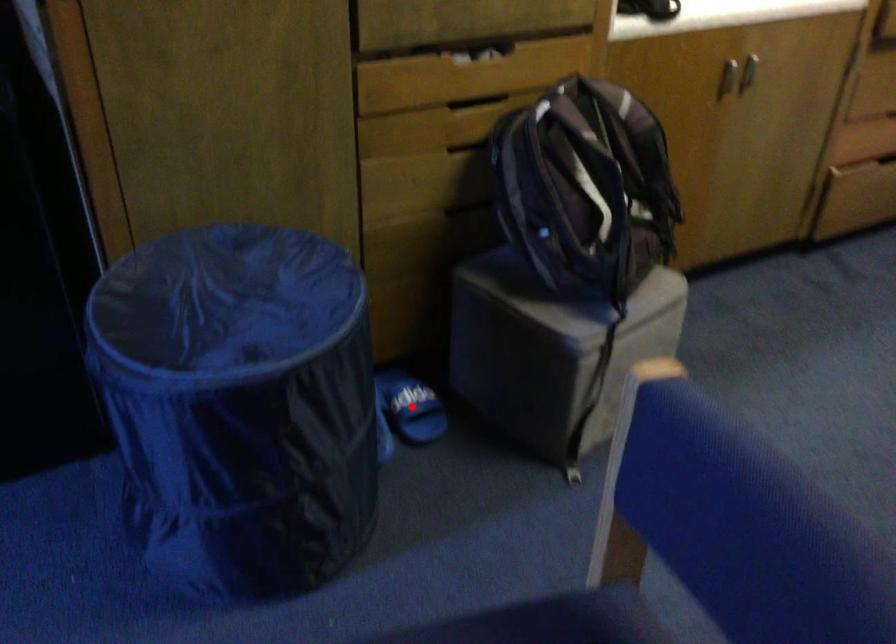
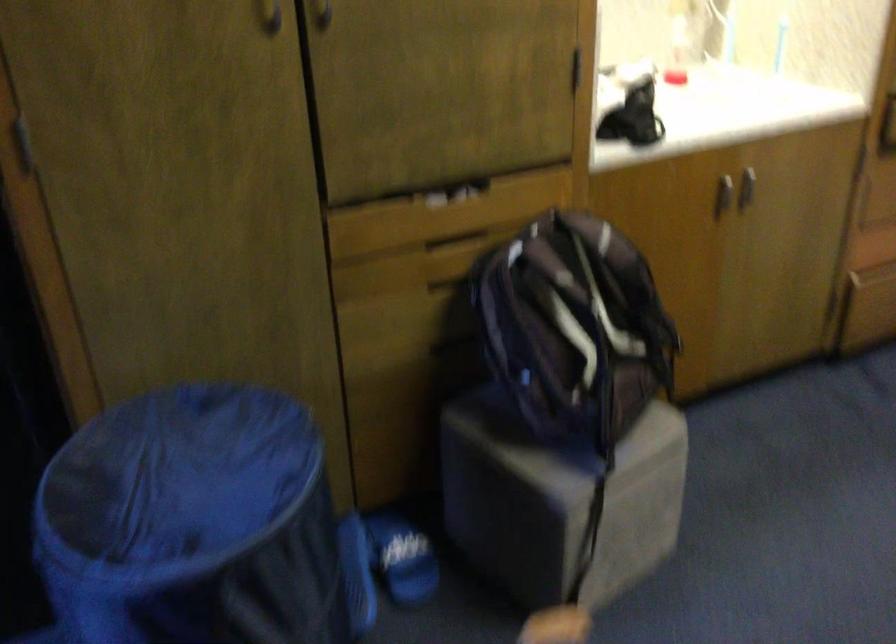
Question: I am providing you with two images of the same scene from different viewpoints. A red point is marked on the first image. At the location where the point appears in image 1, is it still visible in image 2?

Choices:
 (A) Yes
 (B) No

Answer: (A)